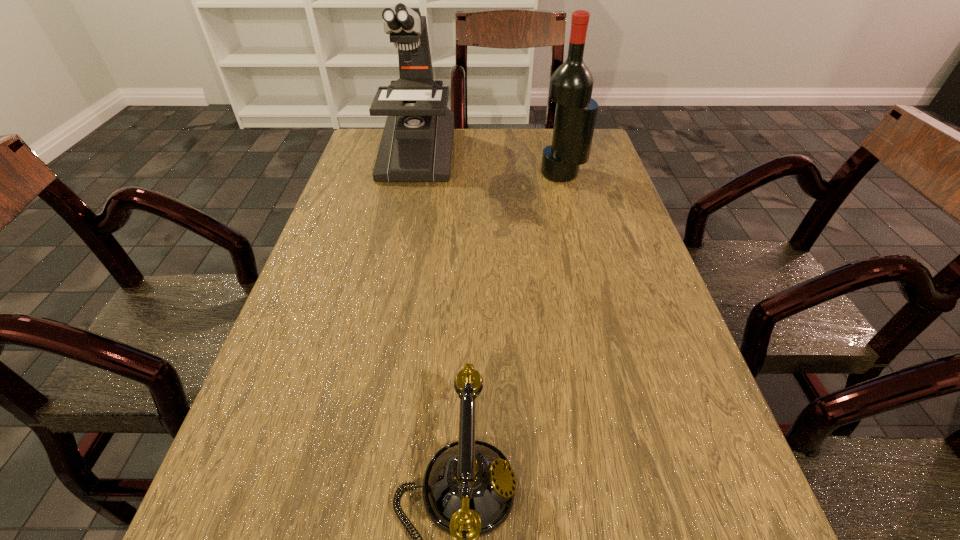
Identify the location of vacant area that satisfies the following two spatial constraints: 1. through the eyepieces of the rightmost object; 2. on the right side of the microscope. This screenshot has width=960, height=540. (412, 173).

This screenshot has width=960, height=540. What are the coordinates of `free region that satisfies the following two spatial constraints: 1. through the eyepieces of the wine bottle; 2. on the left side of the microscope` in the screenshot? It's located at (412, 173).